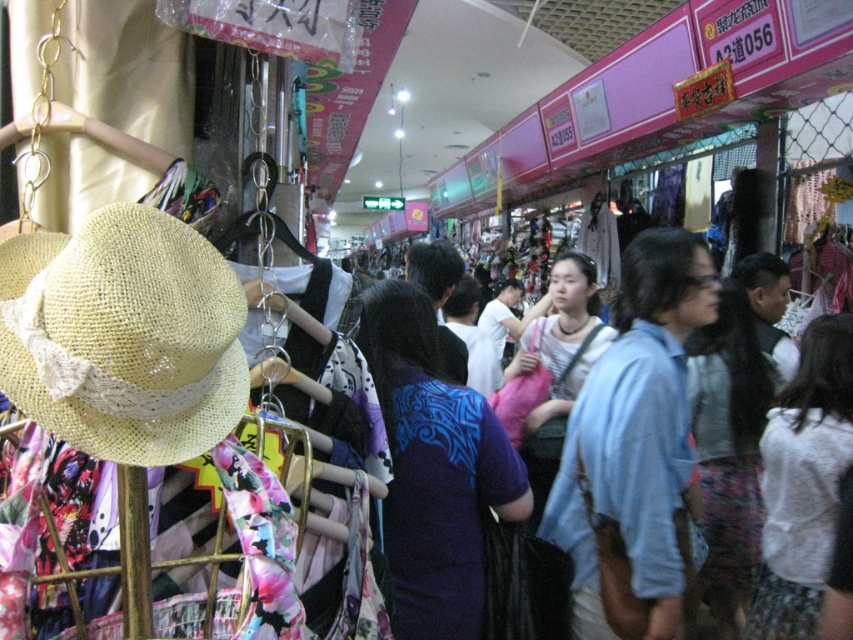
Question: Which of the following is the closest to the observer?

Choices:
 (A) straw hat at left
 (B) white cotton sweater at center
 (C) blue printed dress at center
 (D) matte blue dress at center

Answer: (A)

Question: Is white cotton sweater at center thinner than matte blue dress at center?

Choices:
 (A) no
 (B) yes

Answer: (B)

Question: Where is white cotton sweater at center located in relation to matte blue dress at center in the image?

Choices:
 (A) above
 (B) below

Answer: (B)

Question: Which of the following is the closest to the observer?

Choices:
 (A) matte blue dress at center
 (B) blue printed dress at center
 (C) straw hat at left
 (D) white cotton sweater at center

Answer: (C)

Question: Is straw hat at left positioned at the back of white cotton sweater at center?

Choices:
 (A) no
 (B) yes

Answer: (A)

Question: Among these objects, which one is farthest from the camera?

Choices:
 (A) white cotton sweater at center
 (B) straw hat at left
 (C) blue printed dress at center

Answer: (A)